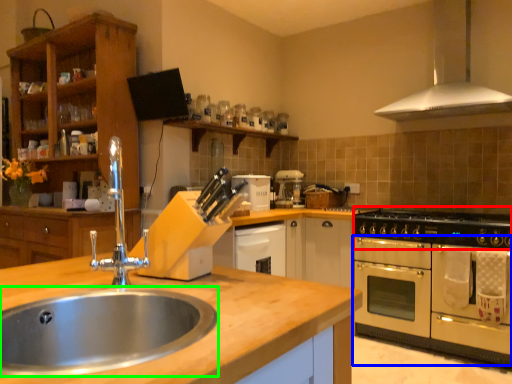
Question: Estimate the real-world distances between objects in this image. Which object is farther from gas stove (highlighted by a red box), oven (highlighted by a blue box) or sink (highlighted by a green box)?

Choices:
 (A) oven
 (B) sink

Answer: (B)